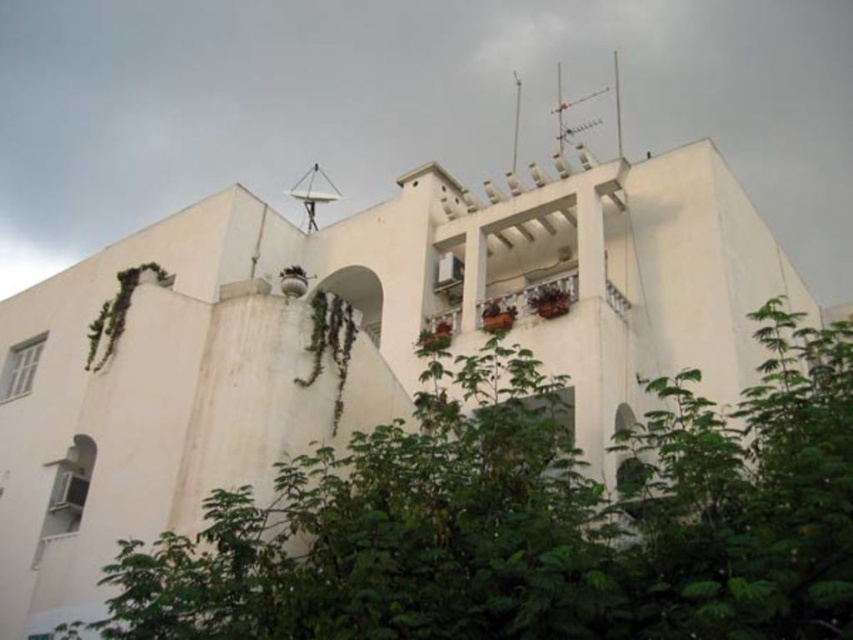
Question: Does green leafy tree at center come behind green leafy plant at left?

Choices:
 (A) yes
 (B) no

Answer: (B)

Question: Does green leafy tree at center appear under green leafy plant at left?

Choices:
 (A) yes
 (B) no

Answer: (A)

Question: Which object is farther from the camera taking this photo?

Choices:
 (A) green leafy plant at left
 (B) green leafy tree at center

Answer: (A)

Question: From the image, what is the correct spatial relationship of green leafy tree at center in relation to green leafy plant at left?

Choices:
 (A) below
 (B) above

Answer: (A)